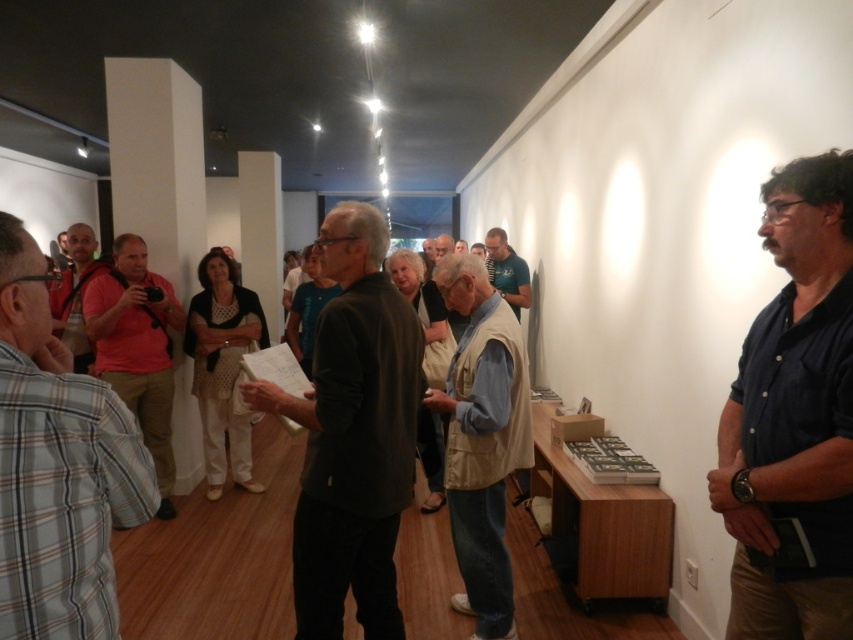
You are organizing a group photo and need to arrange the participants based on their shirt widths. If you have to place the plaid shirt at left and the blue fabric shirt at center in a line from narrowest to widest, where should each be positioned?

The plaid shirt at left should be placed first as it is narrower, followed by the blue fabric shirt at center since its width is greater.

You are a photographer trying to capture a candid shot of the beige fabric vest at center without including the dark brown sweater at center in the frame. Is this possible given their positions?

The dark brown sweater at center is in front of the beige fabric vest at center, so it would block the view of the beige fabric vest at center. Therefore, you cannot capture the beige fabric vest at center without the dark brown sweater at center in the frame.